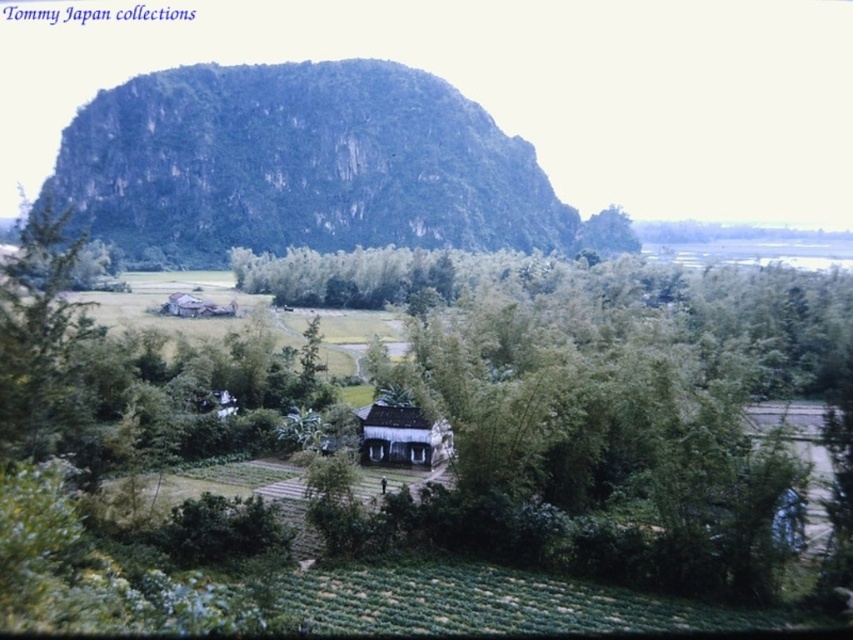
Question: Which point is closer to the camera taking this photo?

Choices:
 (A) (19, 253)
 (B) (167, 305)
 (C) (135, 140)
 (D) (427, 460)

Answer: (A)

Question: Can you confirm if green leafy tree at left is positioned to the left of wooden hut at center?

Choices:
 (A) no
 (B) yes

Answer: (B)

Question: Is green leafy tree at left wider than white wood hut at center?

Choices:
 (A) yes
 (B) no

Answer: (A)

Question: Which point is closer to the camera?

Choices:
 (A) (225, 115)
 (B) (198, 300)
 (C) (71, 346)
 (D) (364, 413)

Answer: (C)

Question: Is green leafy tree at left behind wooden hut at center?

Choices:
 (A) no
 (B) yes

Answer: (A)

Question: Which object is positioned closest to the green rock at upper center?

Choices:
 (A) green leafy tree at left
 (B) white wood hut at center

Answer: (A)